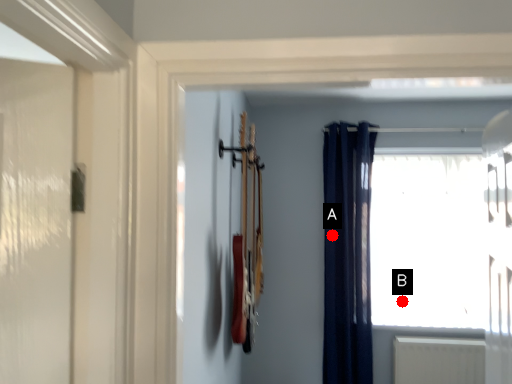
Question: Two points are circled on the image, labeled by A and B beside each circle. Which point is farther from the camera taking this photo?

Choices:
 (A) A is further
 (B) B is further

Answer: (B)